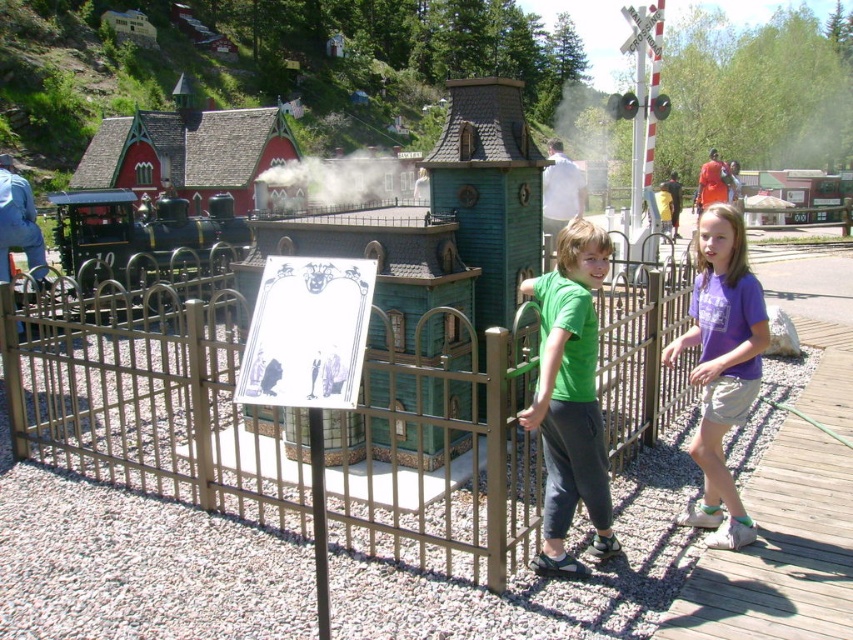
Consider the image. Who is positioned more to the left, green matte shirt at center or purple cotton shirt at right?

green matte shirt at center is more to the left.

Can you confirm if green matte shirt at center is smaller than purple cotton shirt at right?

No, green matte shirt at center is not smaller than purple cotton shirt at right.

This screenshot has width=853, height=640. What are the coordinates of `green matte shirt at center` in the screenshot? It's located at (570, 397).

The image size is (853, 640). I want to click on green matte shirt at center, so click(570, 397).

Which is below, shiny black locomotive at left or white smoke at center?

shiny black locomotive at left is below.

The image size is (853, 640). What do you see at coordinates (136, 228) in the screenshot?
I see `shiny black locomotive at left` at bounding box center [136, 228].

What are the coordinates of `shiny black locomotive at left` in the screenshot? It's located at point(136,228).

Which is behind, point (743, 330) or point (115, 262)?

The point (115, 262) is more distant.

Can you confirm if purple cotton shirt at right is positioned to the left of shiny black locomotive at left?

Incorrect, purple cotton shirt at right is not on the left side of shiny black locomotive at left.

The width and height of the screenshot is (853, 640). Find the location of `purple cotton shirt at right`. purple cotton shirt at right is located at coordinates (722, 365).